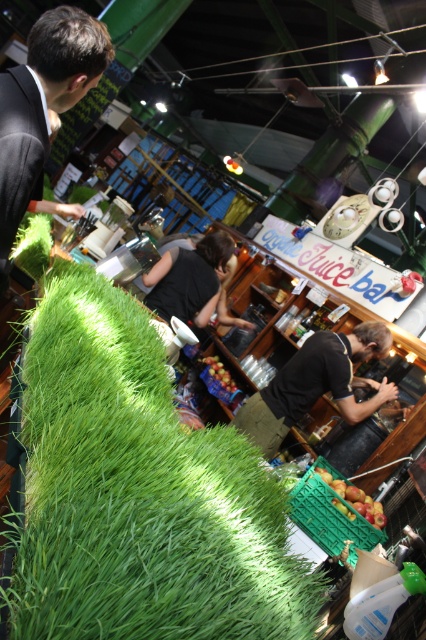
Question: Does green grassy cushion at lower left lie in front of shiny red apples at lower center?

Choices:
 (A) yes
 (B) no

Answer: (A)

Question: Which of these objects is positioned farthest from the green grassy cushion at lower left?

Choices:
 (A) dark suit at left
 (B) black fabric apron at center
 (C) shiny red apples at center

Answer: (C)

Question: Considering the relative positions of black fabric apron at center and shiny red apples at center in the image provided, where is black fabric apron at center located with respect to shiny red apples at center?

Choices:
 (A) left
 (B) right

Answer: (B)

Question: Where is green grassy cushion at lower left located in relation to dark suit at left in the image?

Choices:
 (A) left
 (B) right

Answer: (B)

Question: Which point appears closest to the camera in this image?

Choices:
 (A) (215, 394)
 (B) (97, 67)
 (C) (374, 397)

Answer: (B)

Question: Which point is farther from the camera taking this photo?

Choices:
 (A) (14, 131)
 (B) (39, 440)

Answer: (A)